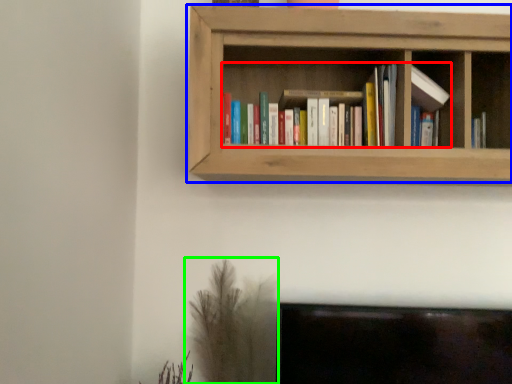
Question: Which object is positioned closest to book (highlighted by a red box)? Select from shelf (highlighted by a blue box) and plant (highlighted by a green box).

Choices:
 (A) shelf
 (B) plant

Answer: (A)